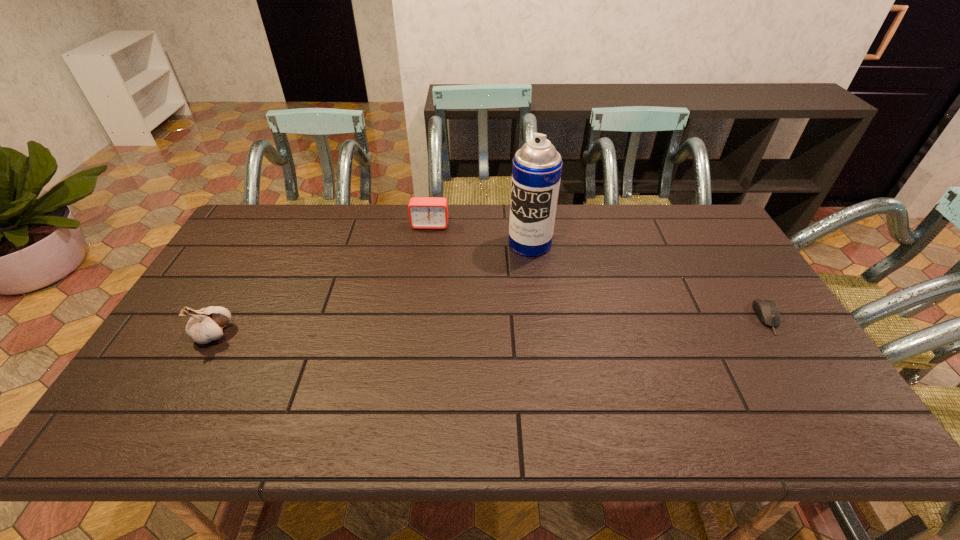
Image resolution: width=960 pixels, height=540 pixels. I want to click on garlic, so click(x=206, y=324).

The image size is (960, 540). I want to click on the third shortest object, so tap(206, 324).

I want to click on the shortest object, so click(766, 310).

Find the location of a particular element. computer mouse is located at coordinates (766, 310).

This screenshot has height=540, width=960. What are the coordinates of `the third object from left to right` in the screenshot? It's located at (536, 171).

Find the location of `the tallest object`. the tallest object is located at coordinates (536, 171).

What are the coordinates of `the second object from left to right` in the screenshot? It's located at (424, 212).

Locate an element on the screen. The image size is (960, 540). the farthest object is located at coordinates (424, 212).

This screenshot has height=540, width=960. Identify the location of vacant space situated on the back of the second tallest object. (237, 291).

Where is `vacant space located 0.060m on the front of the shortest object`? vacant space located 0.060m on the front of the shortest object is located at coordinates (791, 354).